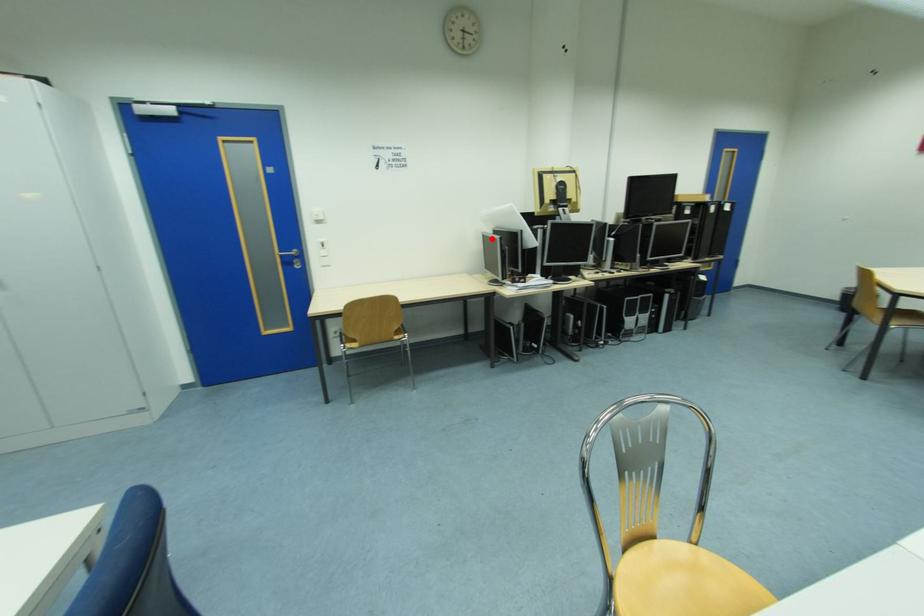
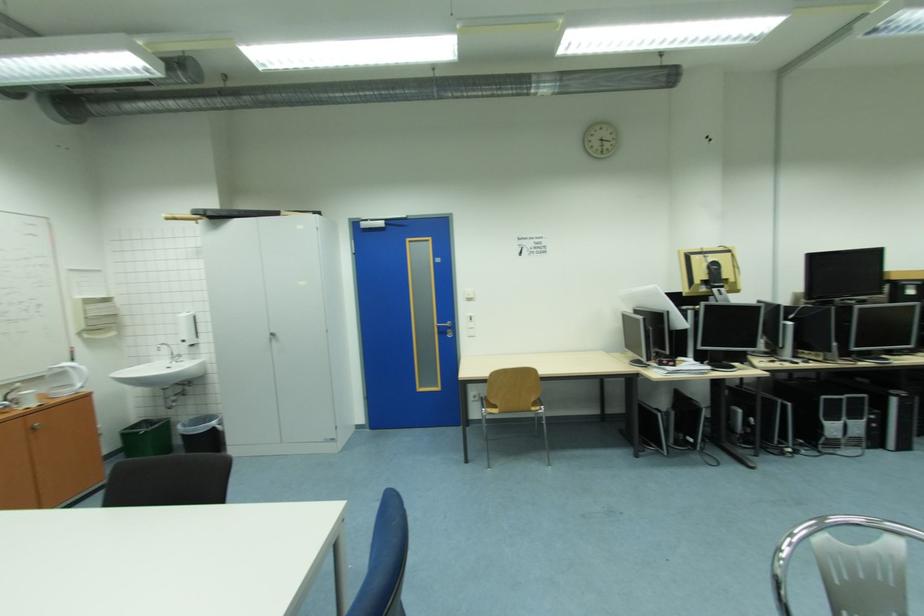
Question: I am providing you with two images of the same scene from different viewpoints. Image1 has a red point marked. In image2, the corresponding 3D location appears at what relative position? Reply with the corresponding letter.

Choices:
 (A) Closer
 (B) Farther

Answer: (B)